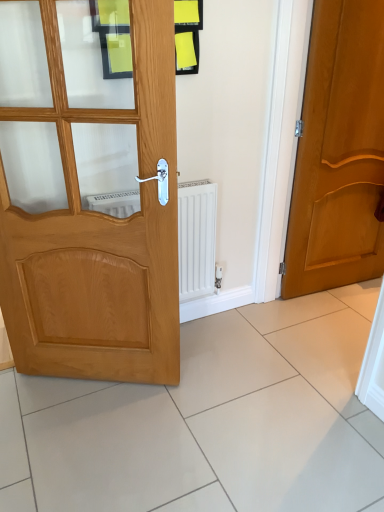
Locate an element on the screen. free location in front of matte wood door at right, which is counted as the 1th door, starting from the right is located at coordinates point(342,304).